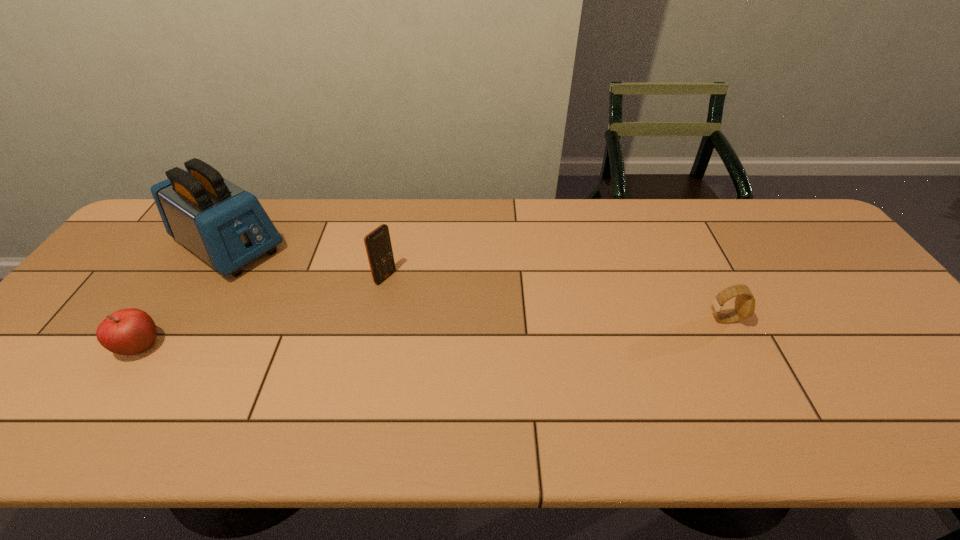
At what (x,y) coordinates should I click in order to perform the action: click on unoccupied area between the tallest object and the watch. Please return your answer as a coordinate pair (x, y). The width and height of the screenshot is (960, 540). Looking at the image, I should click on (476, 282).

Choose which object is the second nearest neighbor to the rightmost object. Please provide its 2D coordinates. Your answer should be formatted as a tuple, i.e. [(x, y)], where the tuple contains the x and y coordinates of a point satisfying the conditions above.

[(226, 226)]

The image size is (960, 540). I want to click on the closest object to the toaster, so click(x=130, y=331).

You are a GUI agent. You are given a task and a screenshot of the screen. Output one action in this format:
    pyautogui.click(x=<x>, y=<y>)
    Task: Click on the free space that satisfies the following two spatial constraints: 1. on the front side of the toaster; 2. on the face of the rightmost object
    This screenshot has width=960, height=540.
    Given the screenshot: What is the action you would take?
    pyautogui.click(x=184, y=319)

Locate an element on the screen. The image size is (960, 540). free space that satisfies the following two spatial constraints: 1. on the front side of the watch; 2. on the face of the tallest object is located at coordinates (184, 319).

At what (x,y) coordinates should I click in order to perform the action: click on vacant position in the image that satisfies the following two spatial constraints: 1. on the back side of the apple; 2. on the left side of the third shortest object. Please return your answer as a coordinate pair (x, y). Looking at the image, I should click on (186, 278).

I want to click on vacant space that satisfies the following two spatial constraints: 1. on the front side of the rightmost object; 2. on the face of the third shortest object, so click(376, 319).

Find the location of a particular element. The height and width of the screenshot is (540, 960). vacant space that satisfies the following two spatial constraints: 1. on the back side of the rightmost object; 2. on the face of the apple is located at coordinates (158, 319).

Image resolution: width=960 pixels, height=540 pixels. What are the coordinates of `vacant region that satisfies the following two spatial constraints: 1. on the back side of the apple; 2. on the face of the watch` in the screenshot? It's located at (158, 319).